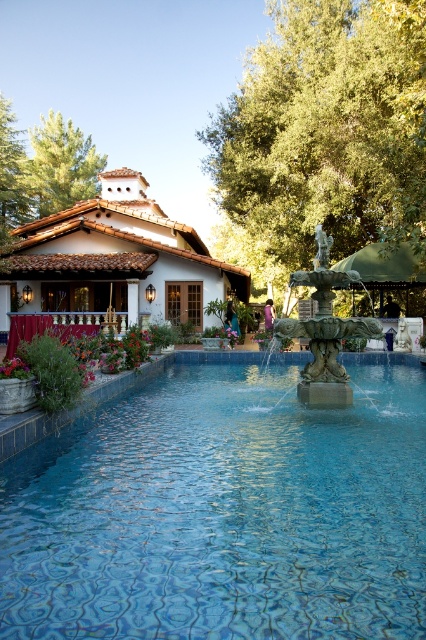
You are a visitor at the fountain area and want to take a photo of both the blue tile swimming pool at center and the green stone fountain at center. Which one should you aim your camera at first to capture both in the frame?

You should aim your camera at the green stone fountain at center first since the blue tile swimming pool at center is located below it, allowing both to be captured in the frame when centered on the fountain.

You are planning to host a swimming competition in the blue tile swimming pool at center. To ensure safety, you need to know if the pool is wider than the green stone fountain at center. Can you confirm this?

The blue tile swimming pool at center is wider than the green stone fountain at center, so yes, the pool is wider than the fountain.